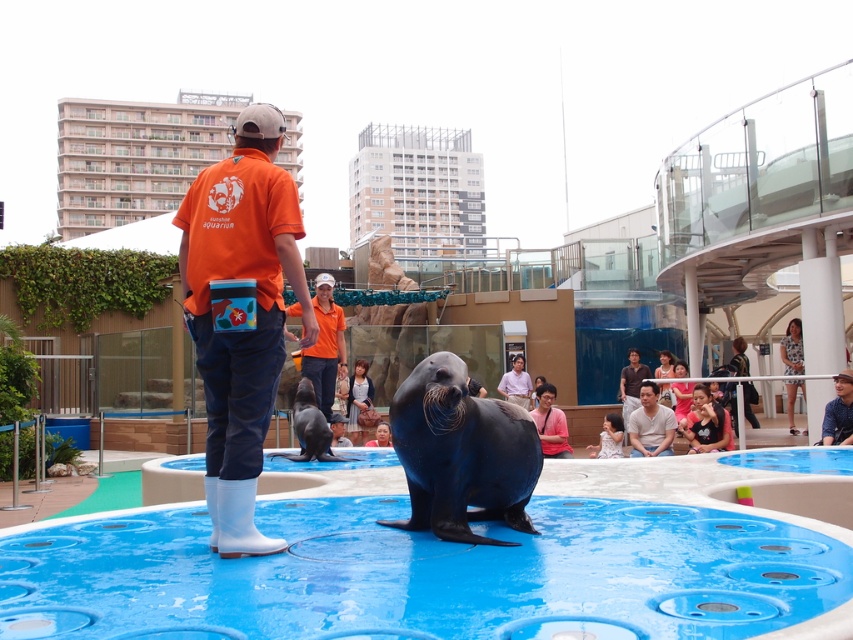
Question: Which point is closer to the camera?

Choices:
 (A) gray cotton t-shirt at lower right
 (B) matte black jacket at lower right
 (C) orange fabric uniform at center

Answer: (C)

Question: Does orange fabric uniform at center come behind dark blue jeans at center?

Choices:
 (A) yes
 (B) no

Answer: (B)

Question: Among these points, which one is farthest from the camera?

Choices:
 (A) (671, 424)
 (B) (521, 378)
 (C) (381, 433)

Answer: (B)

Question: Does floral dress at center have a greater width compared to white matte shirt at center?

Choices:
 (A) no
 (B) yes

Answer: (B)

Question: Is pink matte shirt at center positioned in front of smooth skin face at center?

Choices:
 (A) no
 (B) yes

Answer: (B)

Question: Estimate the real-world distances between objects in this image. Which object is closer to the gray cotton t-shirt at lower right?

Choices:
 (A) smooth brown shirt at center
 (B) orange cotton shirt at center

Answer: (A)